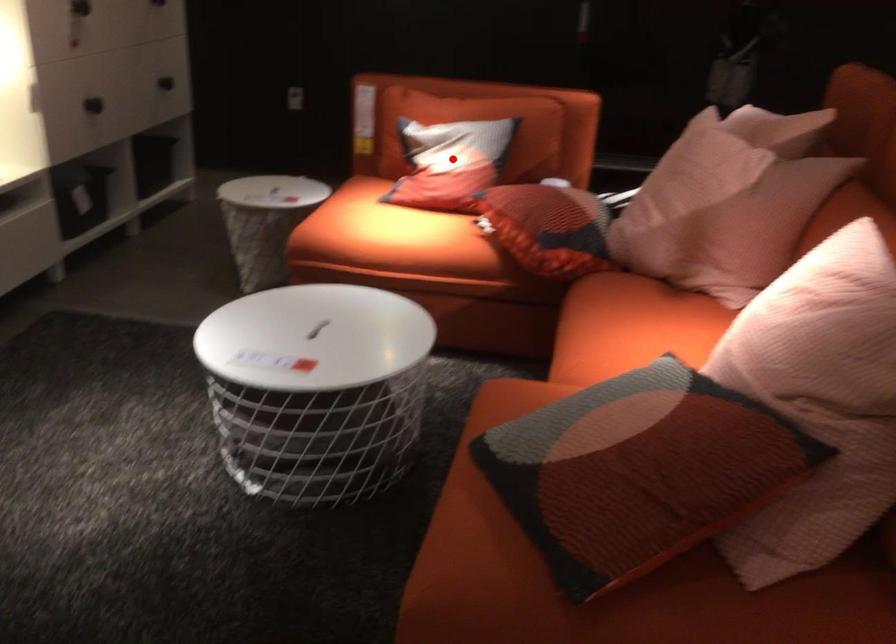
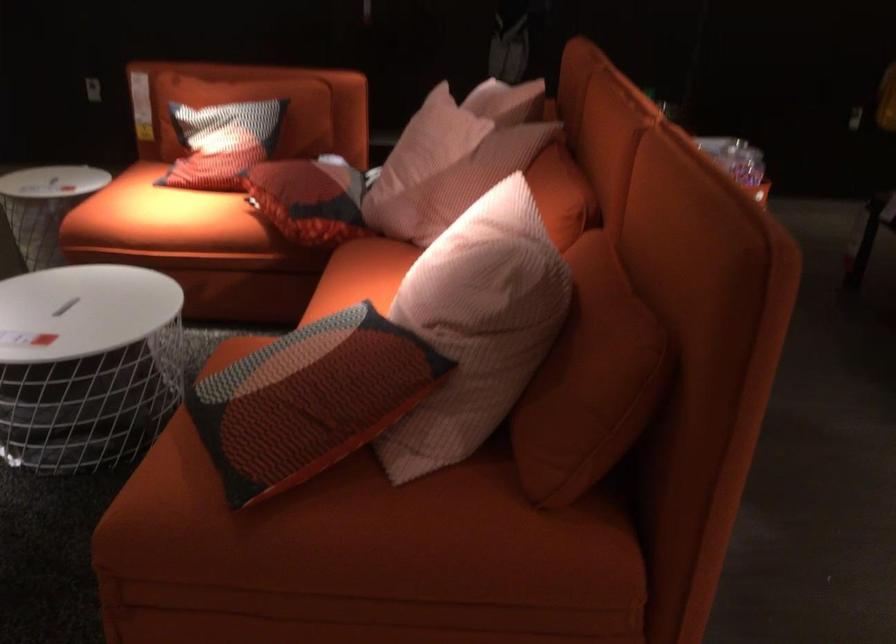
In the second image, find the point that corresponds to the highlighted location in the first image.

(222, 142)